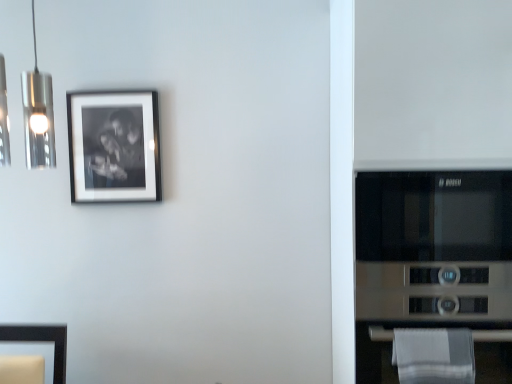
Question: From the image's perspective, is stainless steel microwave at right below matte black frame at upper left?

Choices:
 (A) no
 (B) yes

Answer: (B)

Question: Is stainless steel microwave at right taller than matte black frame at upper left?

Choices:
 (A) no
 (B) yes

Answer: (B)

Question: Is stainless steel microwave at right turned away from matte black frame at upper left?

Choices:
 (A) yes
 (B) no

Answer: (B)

Question: Does stainless steel microwave at right turn towards matte black frame at upper left?

Choices:
 (A) yes
 (B) no

Answer: (B)

Question: From a real-world perspective, is stainless steel microwave at right on matte black frame at upper left?

Choices:
 (A) yes
 (B) no

Answer: (B)

Question: Based on their positions, is stainless steel microwave at right located to the left or right of matte black frame at upper left?

Choices:
 (A) left
 (B) right

Answer: (B)

Question: Does point (380, 183) appear closer or farther from the camera than point (72, 132)?

Choices:
 (A) closer
 (B) farther

Answer: (A)

Question: From a real-world perspective, relative to matte black frame at upper left, is stainless steel microwave at right vertically above or below?

Choices:
 (A) above
 (B) below

Answer: (B)

Question: Considering the positions of stainless steel microwave at right and matte black frame at upper left in the image, is stainless steel microwave at right bigger or smaller than matte black frame at upper left?

Choices:
 (A) small
 (B) big

Answer: (B)

Question: Is point (135, 94) closer or farther from the camera than point (461, 339)?

Choices:
 (A) closer
 (B) farther

Answer: (B)

Question: Is matte black frame at upper left taller or shorter than white cotton towel at lower right?

Choices:
 (A) short
 (B) tall

Answer: (B)

Question: Is matte black frame at upper left inside the boundaries of white cotton towel at lower right, or outside?

Choices:
 (A) outside
 (B) inside

Answer: (A)

Question: Is matte black frame at upper left in front of or behind white cotton towel at lower right in the image?

Choices:
 (A) behind
 (B) front

Answer: (A)

Question: Is white cotton towel at lower right taller or shorter than matte black frame at upper left?

Choices:
 (A) tall
 (B) short

Answer: (B)

Question: Would you say white cotton towel at lower right is to the left or to the right of matte black frame at upper left in the picture?

Choices:
 (A) right
 (B) left

Answer: (A)